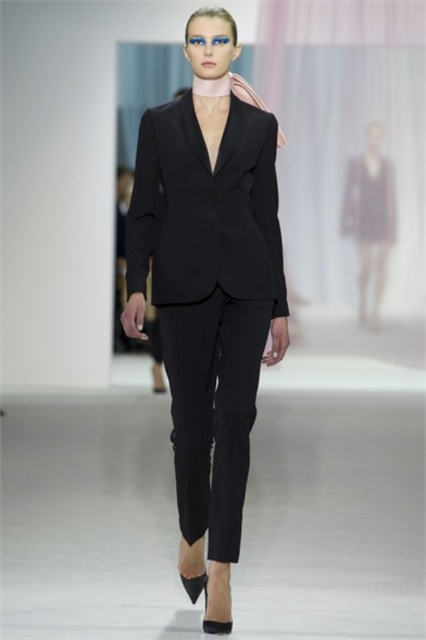
In the scene shown: You are a fashion designer observing the runway show and need to decide which dress to feature in your next collection. Both the matte black dress at right and the purple satin dress at center are on display. Based on their sizes, which dress appears larger?

The matte black dress at right is much taller than the purple satin dress at center, so the matte black dress at right appears larger.

In the scene shown: The model is walking down the runway wearing a black suit. There is a point at coordinates point (370, 218). Which part of the model is this point located on?

The point (370, 218) is located on the matte black dress at right.